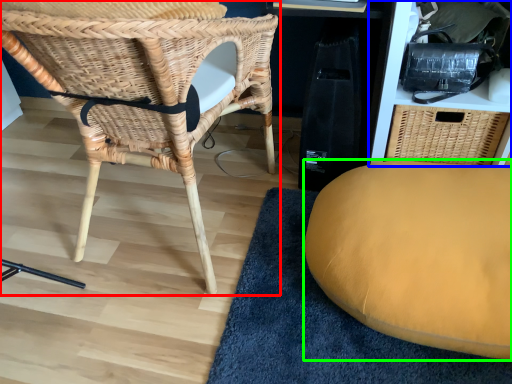
Question: Based on their relative distances, which object is nearer to chair (highlighted by a red box)? Choose from shelf (highlighted by a blue box) and furniture (highlighted by a green box).

Choices:
 (A) shelf
 (B) furniture

Answer: (B)